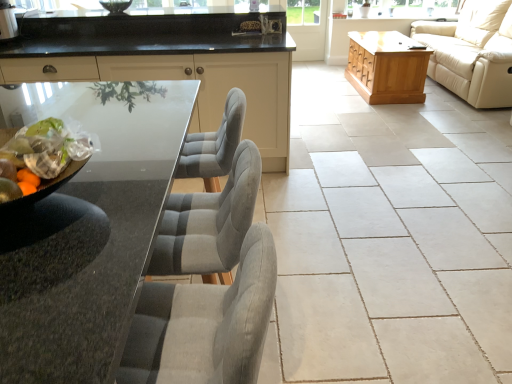
Question: Is matte black cabinetry at center smaller than beige leather couch at right?

Choices:
 (A) yes
 (B) no

Answer: (A)

Question: Does matte black cabinetry at center have a lesser width compared to beige leather couch at right?

Choices:
 (A) no
 (B) yes

Answer: (B)

Question: From a real-world perspective, does matte black cabinetry at center stand above beige leather couch at right?

Choices:
 (A) no
 (B) yes

Answer: (A)

Question: From the image's perspective, is matte black cabinetry at center below beige leather couch at right?

Choices:
 (A) yes
 (B) no

Answer: (A)

Question: Would you consider matte black cabinetry at center to be distant from beige leather couch at right?

Choices:
 (A) no
 (B) yes

Answer: (B)

Question: Is beige ceramic tile at center bigger or smaller than translucent plastic bag of mixed fruits at left?

Choices:
 (A) small
 (B) big

Answer: (B)

Question: Is beige ceramic tile at center in front of or behind translucent plastic bag of mixed fruits at left in the image?

Choices:
 (A) behind
 (B) front

Answer: (A)

Question: In terms of height, does beige ceramic tile at center look taller or shorter compared to translucent plastic bag of mixed fruits at left?

Choices:
 (A) tall
 (B) short

Answer: (B)

Question: Looking at their shapes, would you say beige ceramic tile at center is wider or thinner than translucent plastic bag of mixed fruits at left?

Choices:
 (A) thin
 (B) wide

Answer: (B)

Question: In terms of height, does matte black cabinetry at center look taller or shorter compared to transparent glass screen door at center?

Choices:
 (A) tall
 (B) short

Answer: (A)

Question: From the image's perspective, is matte black cabinetry at center above or below transparent glass screen door at center?

Choices:
 (A) below
 (B) above

Answer: (A)

Question: Does point (272, 153) appear closer or farther from the camera than point (303, 41)?

Choices:
 (A) closer
 (B) farther

Answer: (A)

Question: From a real-world perspective, relative to transparent glass screen door at center, is matte black cabinetry at center vertically above or below?

Choices:
 (A) above
 (B) below

Answer: (A)

Question: Looking at the image, does light brown wooden chest at right seem bigger or smaller compared to transparent glass screen door at center?

Choices:
 (A) big
 (B) small

Answer: (A)

Question: From the image's perspective, is light brown wooden chest at right positioned above or below transparent glass screen door at center?

Choices:
 (A) above
 (B) below

Answer: (B)